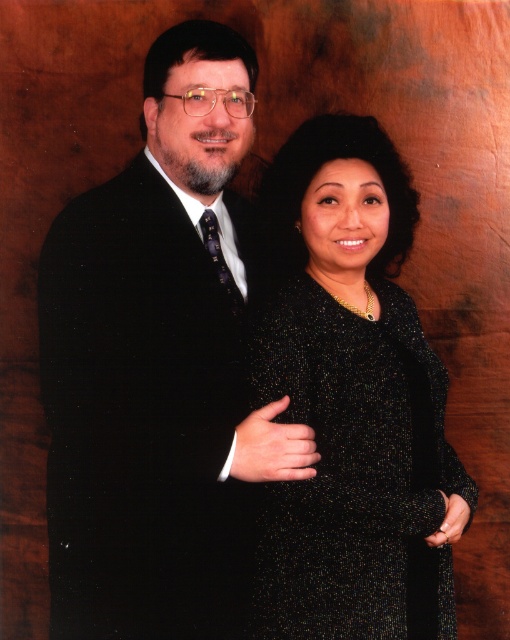
Does satin black suit at left have a larger size compared to sparkly black dress at center?

Correct, satin black suit at left is larger in size than sparkly black dress at center.

Is satin black suit at left below sparkly black dress at center?

No, satin black suit at left is not below sparkly black dress at center.

Is point (209, 355) closer to camera compared to point (267, 564)?

Yes, point (209, 355) is in front of point (267, 564).

I want to click on satin black suit at left, so click(x=158, y=365).